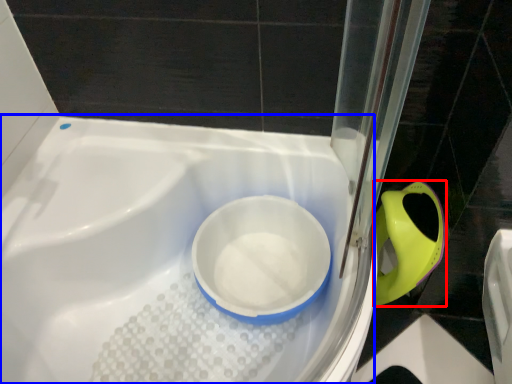
Question: Which of the following is the closest to the observer, bidet (highlighted by a red box) or bath (highlighted by a blue box)?

Choices:
 (A) bidet
 (B) bath

Answer: (B)